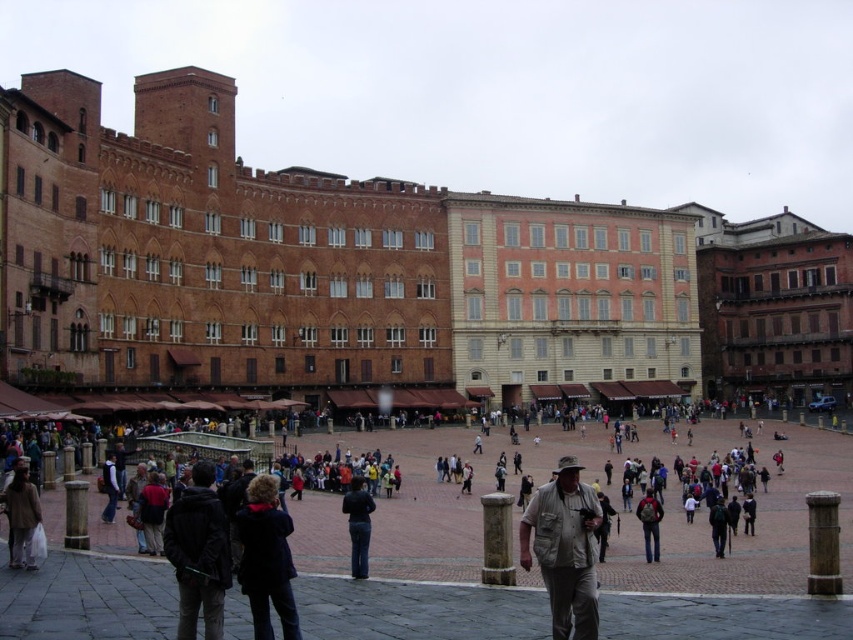
You are a tourist standing in the square and want to take a photo of the dark blue fabric coat at lower center and the dark green backpack at center. Which object should you focus on first to ensure both are in the frame?

You should focus on the dark blue fabric coat at lower center first because it is closer to you than the dark green backpack at center, so adjusting the camera to include both would require starting with the closer object.

You are standing at the entrance of the square and want to find someone wearing a dark gray jacket at lower left who is carrying a dark green backpack at center. How far apart are these two items?

The dark gray jacket at lower left and dark green backpack at center are 25.05 meters apart from each other.

You are standing in the square and see the dark gray jacket at lower left. If you want to approach it, which direction should you walk from your current position at point 0,0?

You should walk towards the lower left direction to reach the dark gray jacket at lower left, as it is located at point (x=198, y=554) relative to your position at (x=0, y=0).